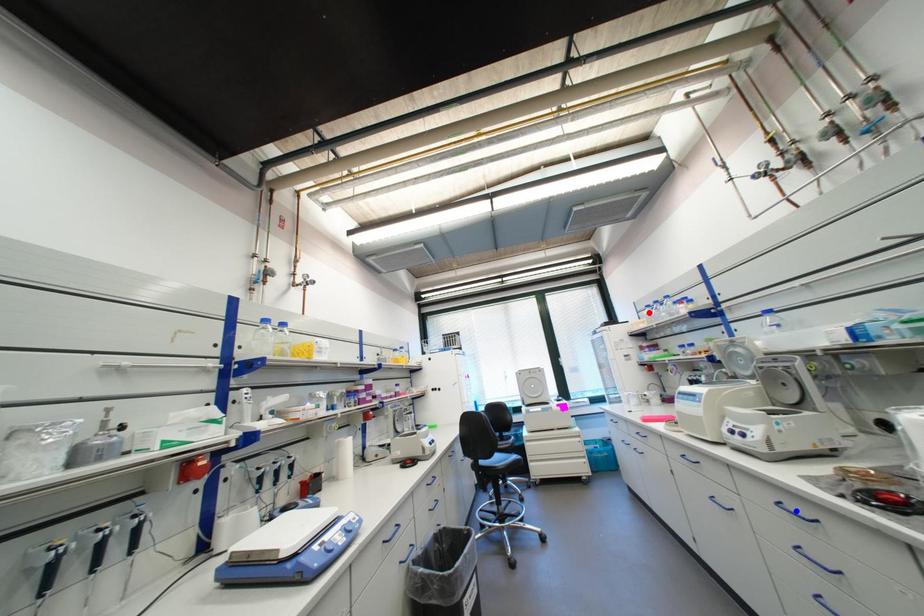
Question: In the image, two points are highlighted. Which point is nearer to the camera? Reply with the corresponding letter.

Choices:
 (A) blue point
 (B) red point

Answer: (A)